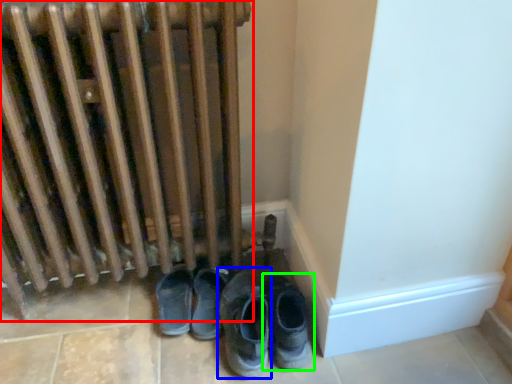
Question: Estimate the real-world distances between objects in this image. Which object is closer to radiator (highlighted by a red box), footwear (highlighted by a blue box) or footwear (highlighted by a green box)?

Choices:
 (A) footwear
 (B) footwear

Answer: (A)